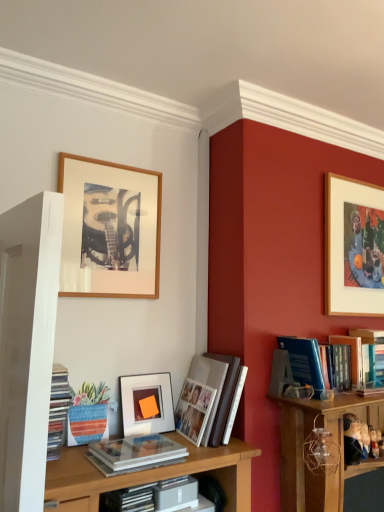
Question: Based on their positions, is matte white book at center, the 2th book when ordered from left to right, located to the left or right of white paper photo album at center, which is the third book from right to left?

Choices:
 (A) left
 (B) right

Answer: (A)

Question: Would you say matte white book at center, the 2th book when ordered from left to right, is inside or outside white paper photo album at center, acting as the 3th book starting from the left?

Choices:
 (A) outside
 (B) inside

Answer: (A)

Question: Estimate the real-world distances between objects in this image. Which object is farther from the matte glass picture frame at center, which appears as the 2th picture frame when viewed from the right?

Choices:
 (A) blue hardcover book at center-right, which ranks as the fourth book in left-to-right order
 (B) matte plastic books at left, marked as the first book in a left-to-right arrangement
 (C) wooden frame at upper left, positioned as the first picture frame in left-to-right order
 (D) gray matte book at center
 (E) matte white book at center, which ranks as the 4th book in right-to-left order

Answer: (A)

Question: Which is farther from the matte white book at center, the 2th book when ordered from left to right?

Choices:
 (A) blue hardcover book at center-right, which is the 2th book in right-to-left order
 (B) gray matte book at center
 (C) blue hardcover book at upper right, marked as the fifth book in a left-to-right arrangement
 (D) matte plastic books at left, which ranks as the fifth book in right-to-left order
 (E) matte glass picture frame at center, marked as the second picture frame in a left-to-right arrangement

Answer: (C)